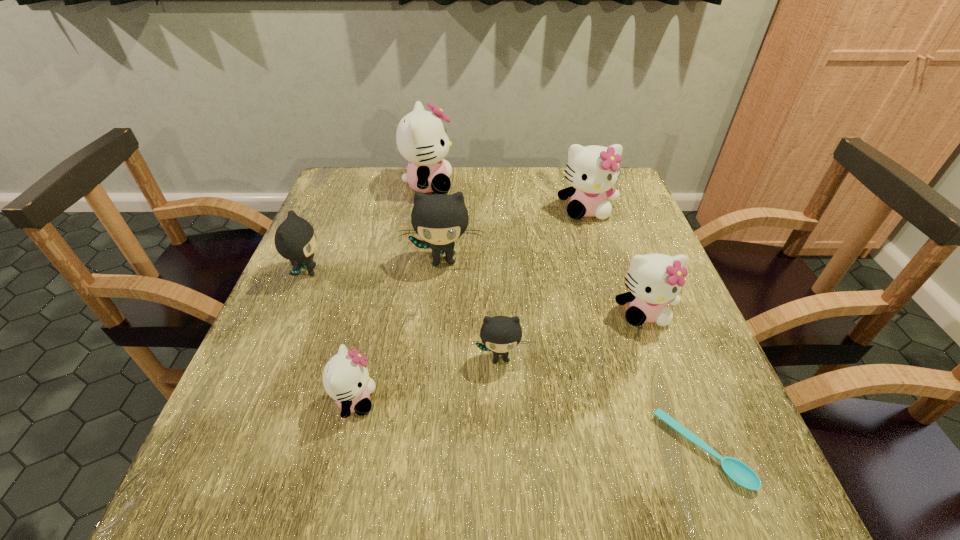
You are a GUI agent. You are given a task and a screenshot of the screen. Output one action in this format:
    pyautogui.click(x=<x>, y=<y>)
    Task: Click on the sixth farthest kitten
    Image resolution: width=960 pixels, height=540 pixels.
    Given the screenshot: What is the action you would take?
    pyautogui.click(x=500, y=334)

Where is `the smallest gray kitten`? The width and height of the screenshot is (960, 540). the smallest gray kitten is located at coordinates (500, 334).

The width and height of the screenshot is (960, 540). Find the location of `blue spoon`. blue spoon is located at coordinates (737, 471).

Locate an element on the screen. The height and width of the screenshot is (540, 960). spoon is located at coordinates (737, 471).

Locate an element on the screen. Image resolution: width=960 pixels, height=540 pixels. vacant space located 0.050m on the front-facing side of the tallest object is located at coordinates (470, 185).

Where is `free space located 0.190m on the front-facing side of the second biggest white kitten`? Image resolution: width=960 pixels, height=540 pixels. free space located 0.190m on the front-facing side of the second biggest white kitten is located at coordinates (605, 271).

Identify the location of vacant space located on the front-facing side of the biggest gray kitten. This screenshot has width=960, height=540. (439, 302).

This screenshot has width=960, height=540. Find the location of `free space located on the front-facing side of the fifth farthest kitten`. free space located on the front-facing side of the fifth farthest kitten is located at coordinates (670, 386).

Where is `vacant space located on the front-facing side of the leftmost kitten`? This screenshot has height=540, width=960. vacant space located on the front-facing side of the leftmost kitten is located at coordinates (462, 272).

Find the location of a particular element. The image size is (960, 540). vacant space located on the front-facing side of the nearest kitten is located at coordinates (483, 400).